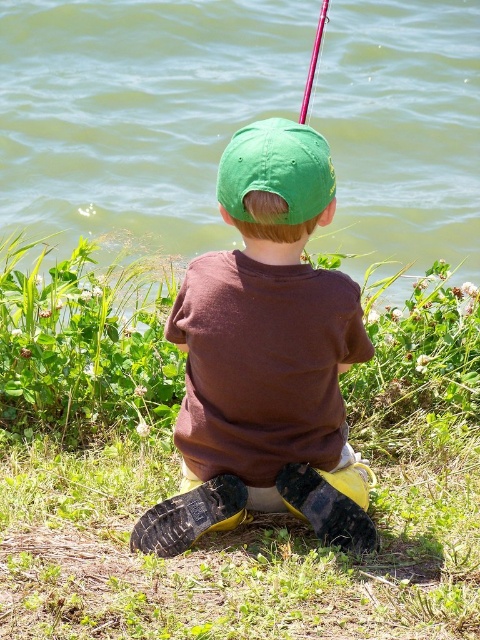
Question: Considering the real-world distances, which object is farthest from the green water at upper center?

Choices:
 (A) green matte cap at center
 (B) metallic red fishing pole at upper center

Answer: (A)

Question: Does green fabric cap at center have a larger size compared to metallic red fishing pole at upper center?

Choices:
 (A) no
 (B) yes

Answer: (A)

Question: Can you confirm if green matte cap at center is positioned to the left of metallic red fishing pole at upper center?

Choices:
 (A) yes
 (B) no

Answer: (A)

Question: Which object is the closest to the metallic red fishing pole at upper center?

Choices:
 (A) green water at upper center
 (B) green matte cap at center
 (C) green grass at center
 (D) green fabric cap at center

Answer: (A)

Question: In this image, where is green grass at center located relative to green water at upper center?

Choices:
 (A) above
 (B) below

Answer: (B)

Question: Estimate the real-world distances between objects in this image. Which object is closer to the green water at upper center?

Choices:
 (A) green matte cap at center
 (B) green fabric cap at center
 (C) green grass at center

Answer: (C)